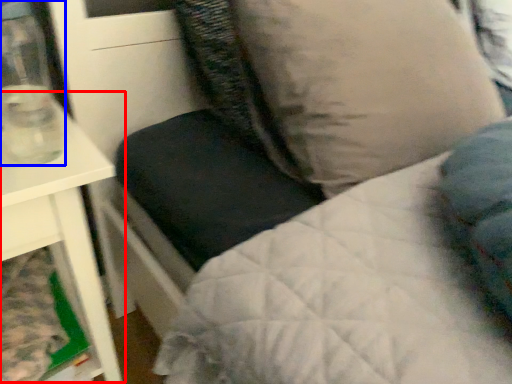
Question: Which of the following is the closest to the observer, table (highlighted by a red box) or glass vase (highlighted by a blue box)?

Choices:
 (A) table
 (B) glass vase

Answer: (B)